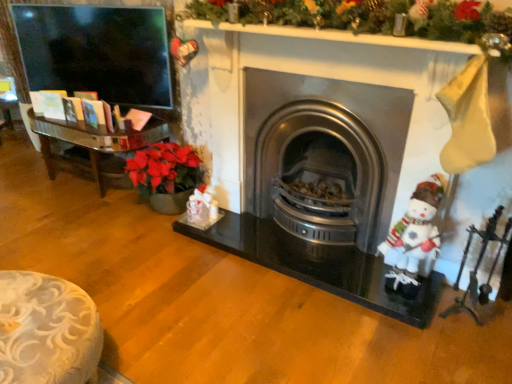
Question: Considering the positions of stainless steel wood burning stove at center and white fabric santa claus at right in the image, is stainless steel wood burning stove at center bigger or smaller than white fabric santa claus at right?

Choices:
 (A) big
 (B) small

Answer: (A)

Question: Considering the positions of stainless steel wood burning stove at center and white fabric santa claus at right in the image, is stainless steel wood burning stove at center wider or thinner than white fabric santa claus at right?

Choices:
 (A) wide
 (B) thin

Answer: (A)

Question: Estimate the real-world distances between objects in this image. Which object is closer to the stainless steel wood burning stove at center?

Choices:
 (A) metallic silver fireplace tools at right
 (B) white fabric santa claus at right

Answer: (B)

Question: Considering the real-world distances, which object is farthest from the stainless steel wood burning stove at center?

Choices:
 (A) metallic silver fireplace tools at right
 (B) white fabric santa claus at right

Answer: (A)